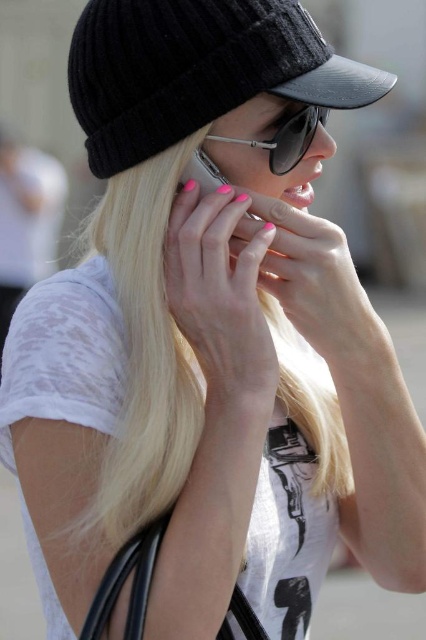
Question: Is black knitted baseball hat at upper left positioned behind sunglasses at center?

Choices:
 (A) yes
 (B) no

Answer: (B)

Question: Among these points, which one is nearest to the camera?

Choices:
 (A) (241, 72)
 (B) (273, 172)

Answer: (A)

Question: Which object is closer to the camera taking this photo?

Choices:
 (A) black knitted baseball hat at upper left
 (B) sunglasses at center

Answer: (A)

Question: Can you confirm if black knitted baseball hat at upper left is positioned below sunglasses at center?

Choices:
 (A) no
 (B) yes

Answer: (A)

Question: Does black knitted baseball hat at upper left come behind sunglasses at center?

Choices:
 (A) yes
 (B) no

Answer: (B)

Question: Which point is farther to the camera?

Choices:
 (A) black knitted baseball hat at upper left
 (B) sunglasses at center

Answer: (B)